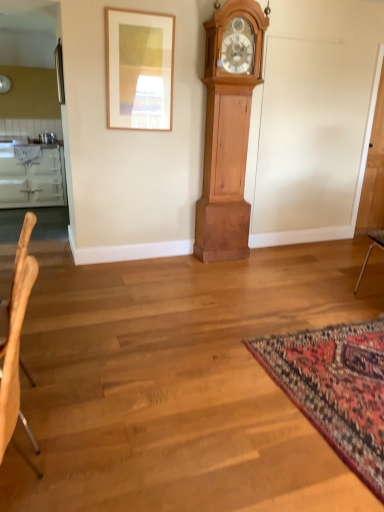
Identify the location of vacant space to the right of light brown wood chair at left. (145, 487).